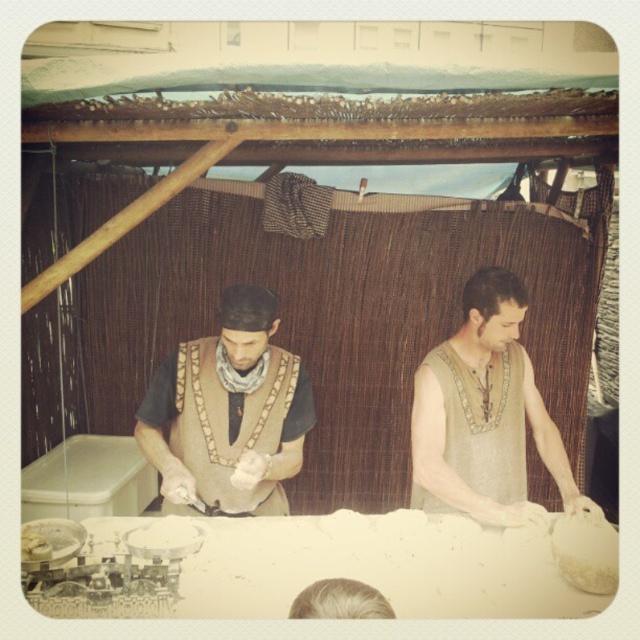
You are a chef who needs to prepare dough on the white matte table at center. However, you notice the white flour at center is in the way. Can you move the flour to the side without stepping behind the table?

The white matte table at center is closer to the viewer than the white flour at center, meaning the flour is behind the table from your perspective. To move it, you would need to step behind the table to access it.

You are standing in front of the pottery workshop scene. You see the white matte table at center and the brown woven vest at center. Which object is positioned to the right of the other?

The white matte table at center is to the right of brown woven vest at center.

You are standing in front of the pottery workshop scene. You notice two points marked in the image. The first point is at coordinates point (483,536) and the second is at point (20,547). Which of these two points is closer to you?

Point (483,536) is closer to you because it is further to the viewer than point (20,547).